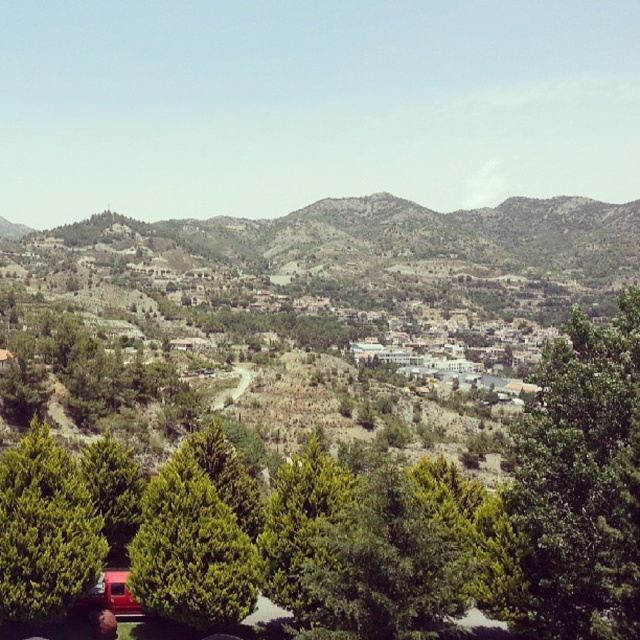
You are a hiker trying to navigate through the hilly landscape. You see two green trees at the lower left corner of your view. How far apart are the green leafy tree at lower left and the green textured tree at lower left?

The green leafy tree at lower left is 17.99 feet from green textured tree at lower left.